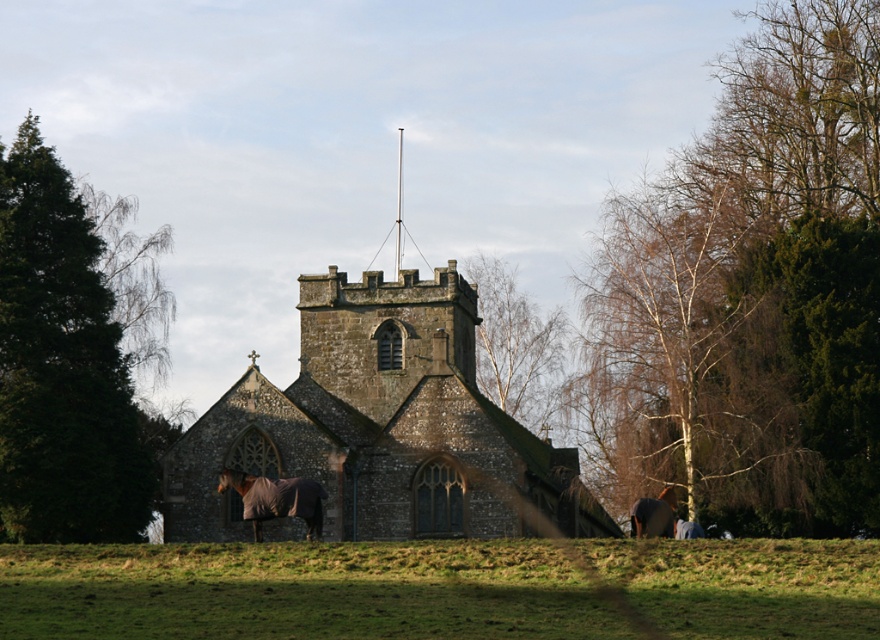
Who is higher up, green leafy tree at left or brown fleece horse at lower left?

green leafy tree at left is higher up.

Can you confirm if green leafy tree at left is taller than brown fleece horse at lower left?

Yes, green leafy tree at left is taller than brown fleece horse at lower left.

Where is `green leafy tree at left`? The width and height of the screenshot is (880, 640). green leafy tree at left is located at coordinates (66, 360).

Is green grass at lower center shorter than stone church at center?

Indeed, green grass at lower center has a lesser height compared to stone church at center.

This screenshot has width=880, height=640. Identify the location of green grass at lower center. (301, 589).

Can you confirm if green grass at lower center is shorter than brown fleece horse at lower left?

Indeed, green grass at lower center has a lesser height compared to brown fleece horse at lower left.

Between point (376, 618) and point (269, 500), which one is positioned in front?

Point (376, 618)

The image size is (880, 640). What do you see at coordinates (301, 589) in the screenshot? I see `green grass at lower center` at bounding box center [301, 589].

Identify the location of green grass at lower center. (301, 589).